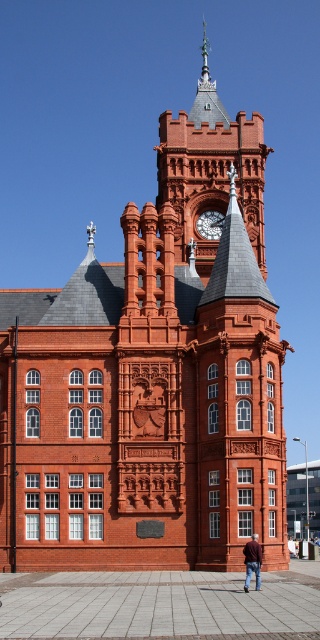
Does brown leather jacket at lower center appear over polished brass clock at upper center?

Incorrect, brown leather jacket at lower center is not positioned above polished brass clock at upper center.

Does point (245, 545) come farther from viewer compared to point (198, 218)?

No, (245, 545) is in front of (198, 218).

Where is `brown leather jacket at lower center`? The height and width of the screenshot is (640, 320). brown leather jacket at lower center is located at coordinates (253, 561).